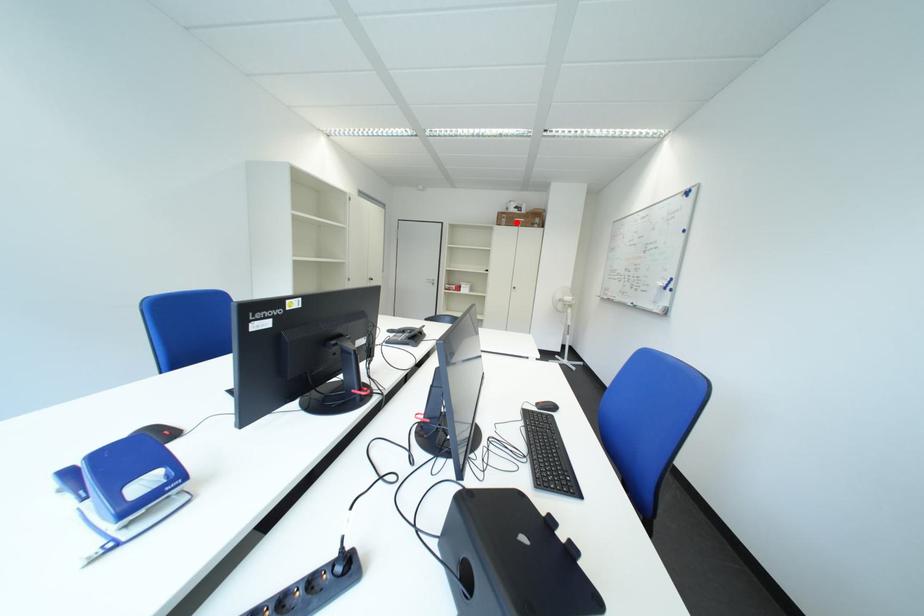
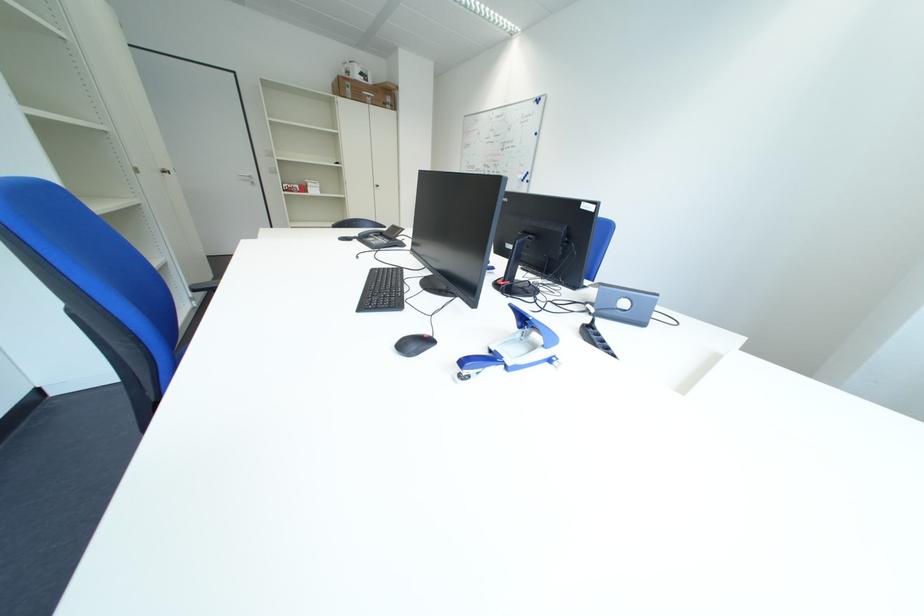
In the second image, find the point that corresponds to the highlighted location in the first image.

(360, 92)